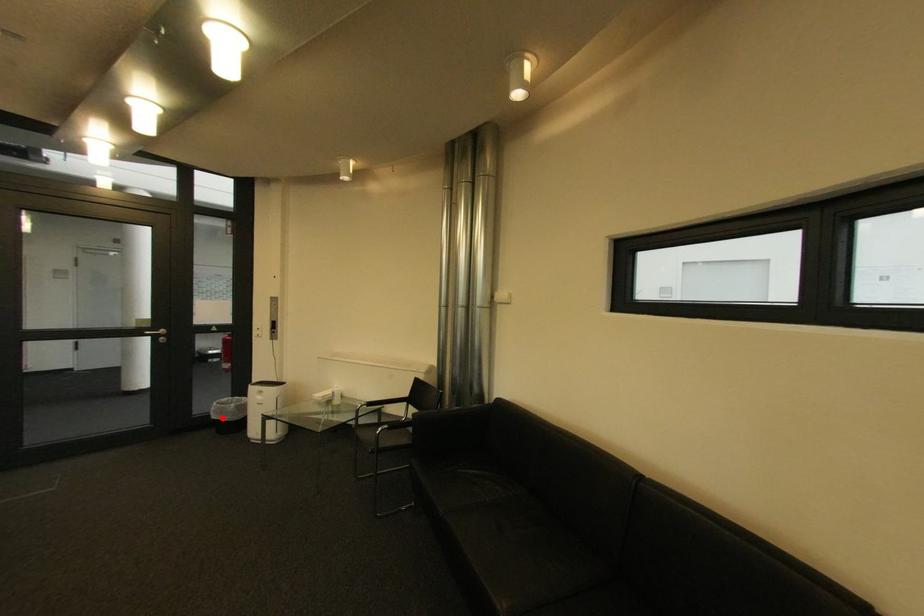
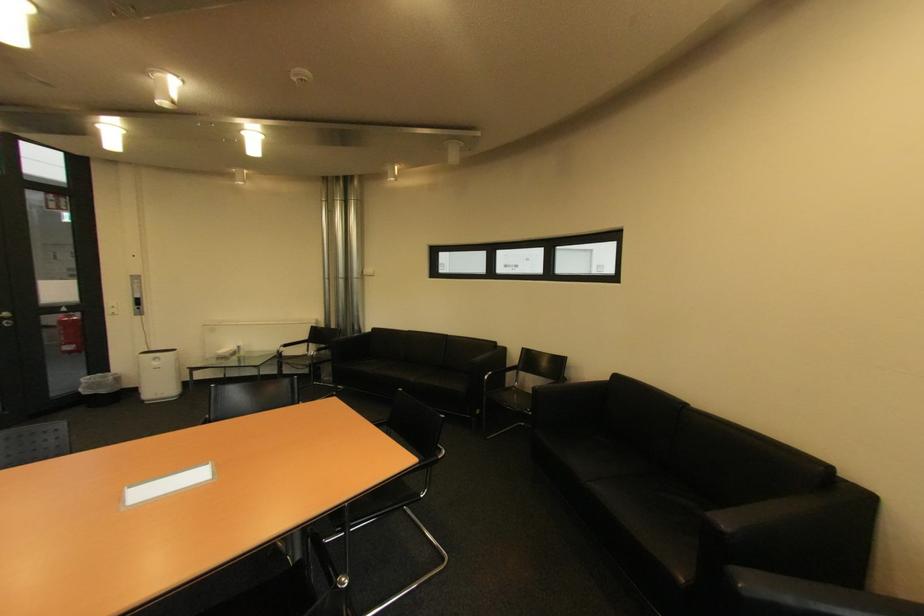
The point at the highlighted location is marked in the first image. Where is the corresponding point in the second image?

(94, 394)